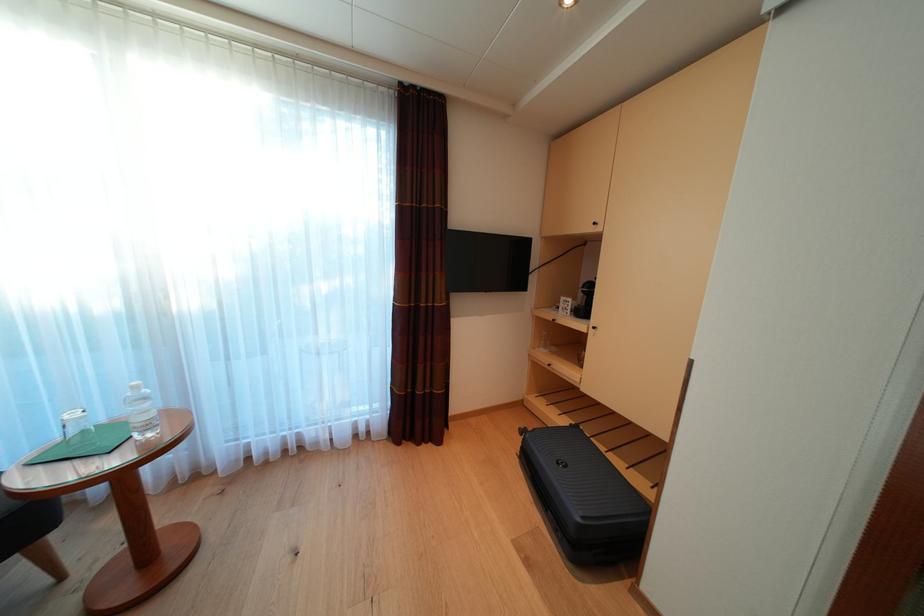
I want to click on chair sitting surface, so click(26, 523).